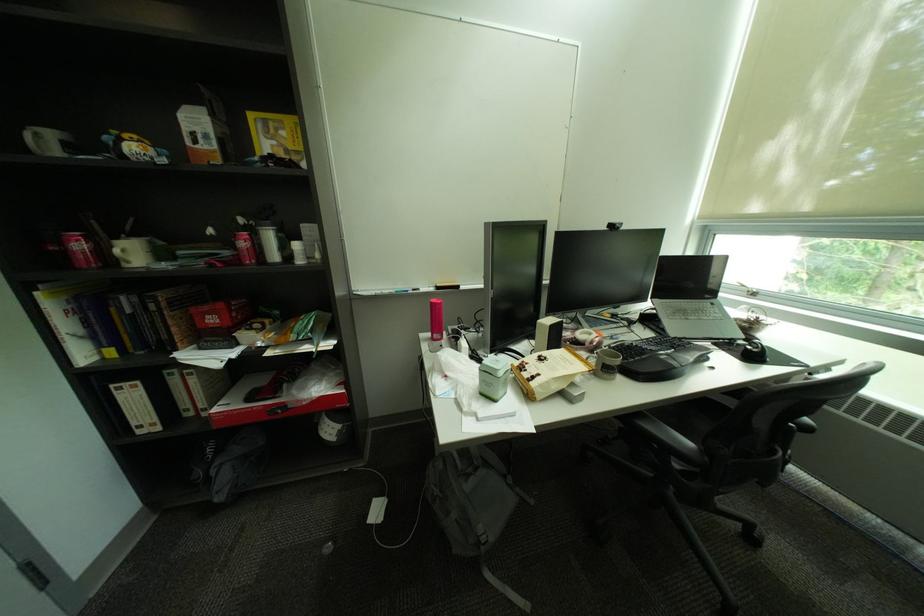
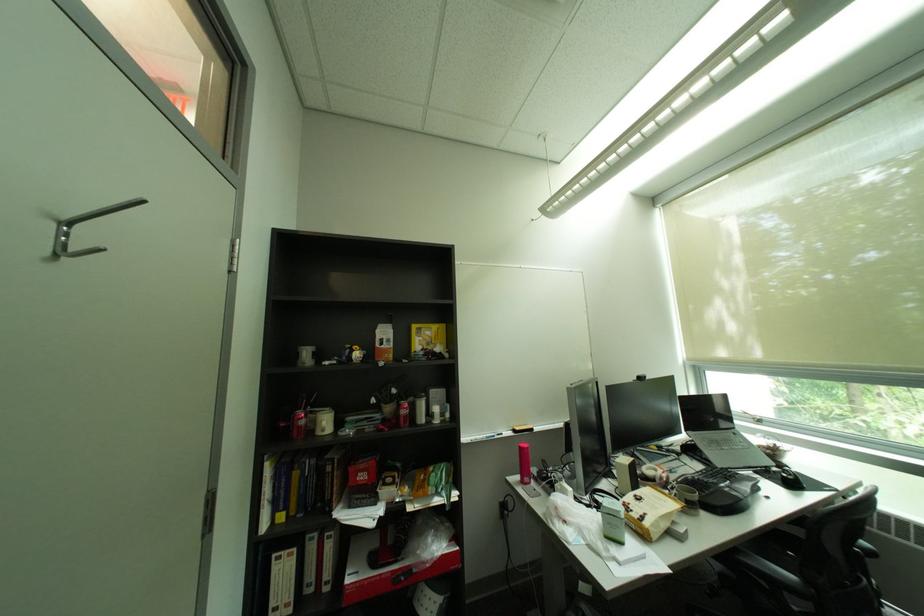
In the second image, find the point that corresponds to point 658,341 in the first image.

(712, 472)